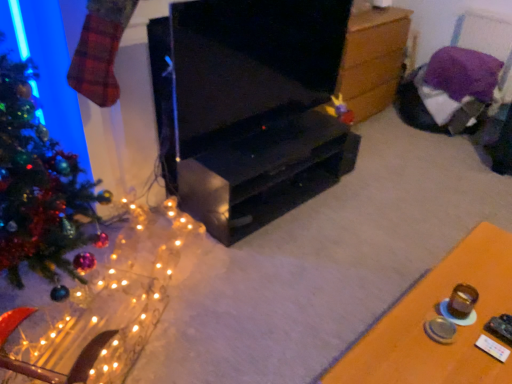
Identify the location of vacant area that lies between black matte tv cabinet at center and illuminated wire mesh at left. (231, 266).